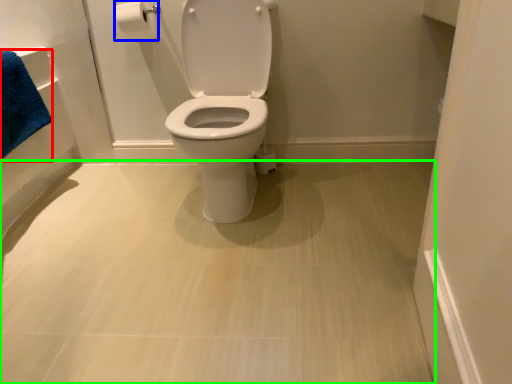
Question: Estimate the real-world distances between objects in this image. Which object is farther from bath towel (highlighted by a red box), toilet paper (highlighted by a blue box) or plain (highlighted by a green box)?

Choices:
 (A) toilet paper
 (B) plain

Answer: (B)